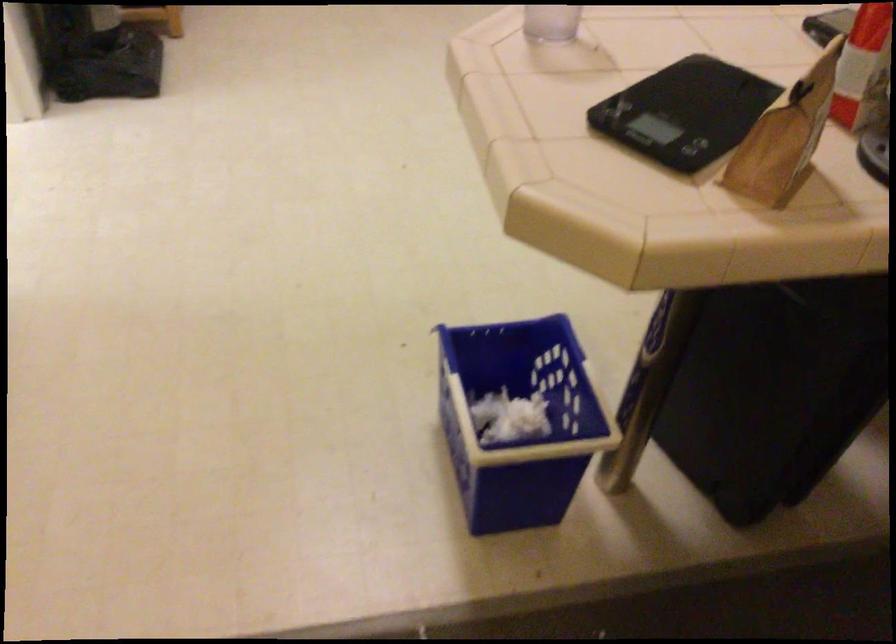
Find the location of a particular element. This screenshot has width=896, height=644. black digital scale is located at coordinates (685, 111).